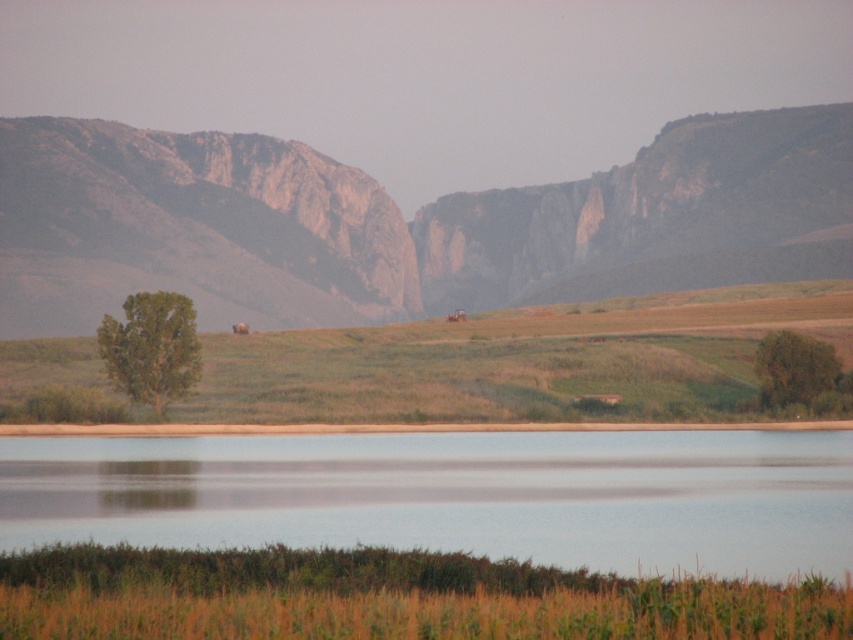
From the picture: Is rugged stone mountain at center smaller than green matte tree at right?

No.

Between rugged stone mountain at center and green matte tree at right, which one is positioned higher?

rugged stone mountain at center is higher up.

Is point (511, 188) positioned after point (785, 342)?

Yes, point (511, 188) is behind point (785, 342).

Find the location of `rugged stone mountain at center`. rugged stone mountain at center is located at coordinates (375, 220).

Which is below, transparent water at center or green matte tree at right?

transparent water at center is lower down.

Measure the distance between transparent water at center and camera.

They are 27.61 meters apart.

Image resolution: width=853 pixels, height=640 pixels. What do you see at coordinates (453, 496) in the screenshot? I see `transparent water at center` at bounding box center [453, 496].

Identify the location of transparent water at center. (453, 496).

The image size is (853, 640). Describe the element at coordinates (152, 348) in the screenshot. I see `green leafy tree at center` at that location.

This screenshot has width=853, height=640. What are the coordinates of `green leafy tree at center` in the screenshot? It's located at (152, 348).

Does point (144, 321) come farther from viewer compared to point (799, 387)?

Yes, point (144, 321) is farther from viewer.

Where is `green leafy tree at center`? This screenshot has height=640, width=853. green leafy tree at center is located at coordinates (152, 348).